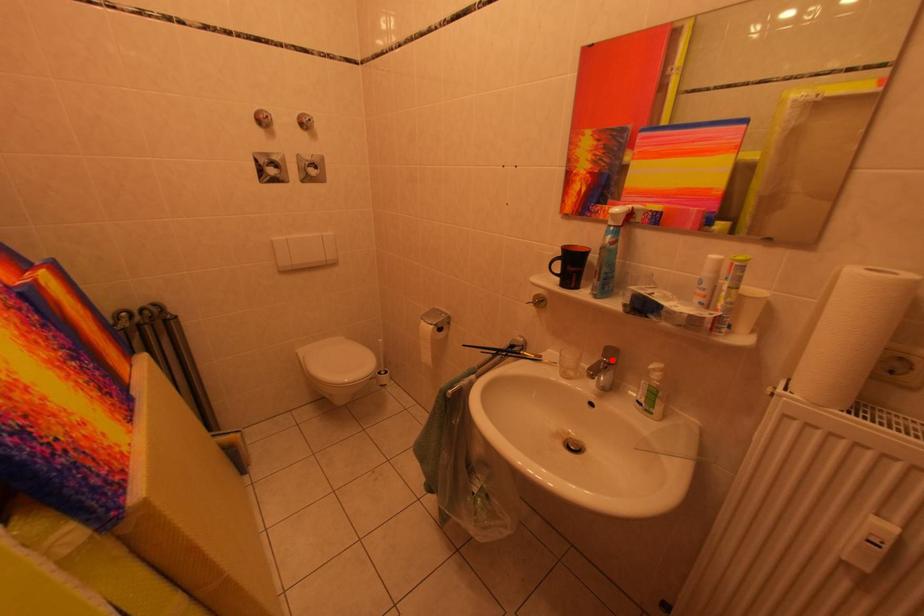
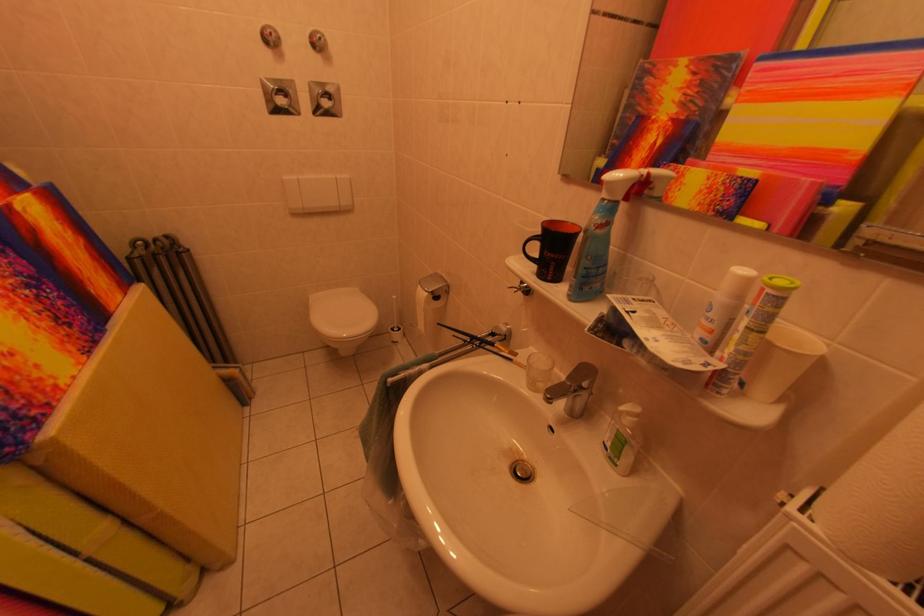
In the second image, find the point that corresponds to the highlighted location in the first image.

(578, 382)